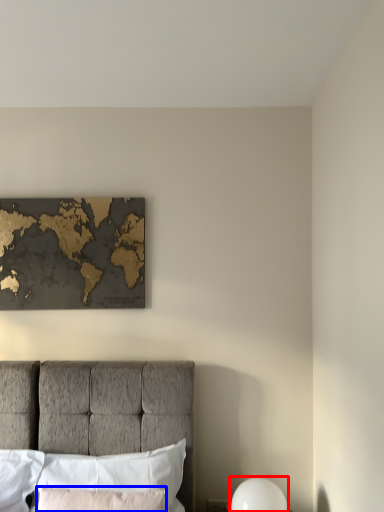
Question: Which object is closer to the camera taking this photo, bedside lamp (highlighted by a red box) or pillow (highlighted by a blue box)?

Choices:
 (A) bedside lamp
 (B) pillow

Answer: (B)